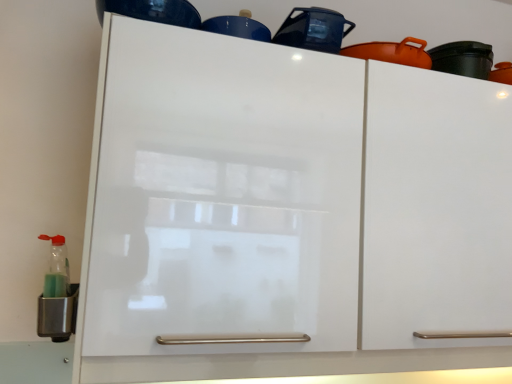
Question: From the image's perspective, is metallic green bottle at lower left, the 3th appliance in the right-to-left sequence, above or below glossy ceramic pot at upper center, which ranks as the 2th appliance in bottom-to-top order?

Choices:
 (A) below
 (B) above

Answer: (A)

Question: From a real-world perspective, relative to glossy ceramic pot at upper center, which ranks as the second appliance in top-to-bottom order, is metallic green bottle at lower left, the 3th appliance when ordered from top to bottom, vertically above or below?

Choices:
 (A) above
 (B) below

Answer: (B)

Question: Estimate the real-world distances between objects in this image. Which object is closer to the metallic green bottle at lower left, the 3th appliance when ordered from top to bottom?

Choices:
 (A) glossy ceramic pot at upper center, which ranks as the second appliance in top-to-bottom order
 (B) glossy blue cup at upper center, the third appliance in the bottom-to-top sequence

Answer: (B)

Question: Which object is the farthest from the glossy ceramic pot at upper center, which ranks as the second appliance in top-to-bottom order?

Choices:
 (A) metallic green bottle at lower left, placed as the 1th appliance when sorted from bottom to top
 (B) glossy blue cup at upper center, acting as the first appliance starting from the top

Answer: (A)